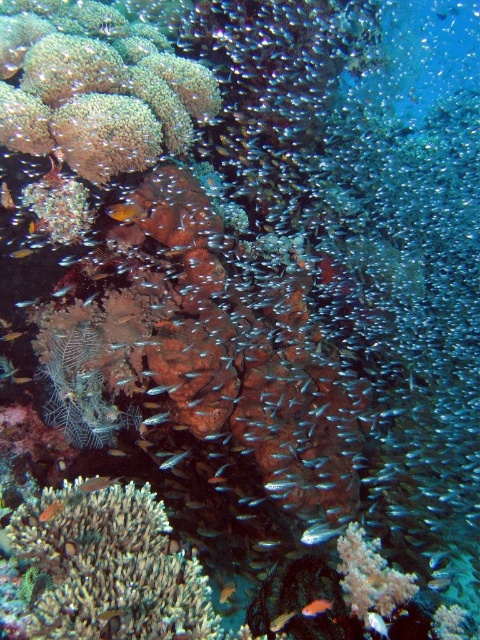
Between green coral at center and orange matte fish at lower center, which one is positioned higher?

green coral at center

Is point (192, 576) closer to camera compared to point (227, 598)?

Yes, it is.

Describe the element at coordinates (111, 566) in the screenshot. The image size is (480, 640). I see `green coral at center` at that location.

Find the location of `green coral at center`. green coral at center is located at coordinates (111, 566).

Is orange glossy fish at lower right smaller than shiny orange fish at center?

Yes.

Is orange glossy fish at lower right to the right of shiny orange fish at center from the viewer's perspective?

Indeed, orange glossy fish at lower right is positioned on the right side of shiny orange fish at center.

Locate an element on the screen. The image size is (480, 640). orange glossy fish at lower right is located at coordinates (316, 608).

Based on the photo, is orange glossy fish at lower right shorter than shiny silver fish at lower right?

In fact, orange glossy fish at lower right may be taller than shiny silver fish at lower right.

What do you see at coordinates (316, 608) in the screenshot?
I see `orange glossy fish at lower right` at bounding box center [316, 608].

Is point (319, 612) positioned behind point (387, 625)?

Yes, it is behind point (387, 625).

This screenshot has height=640, width=480. I want to click on orange glossy fish at lower right, so point(316,608).